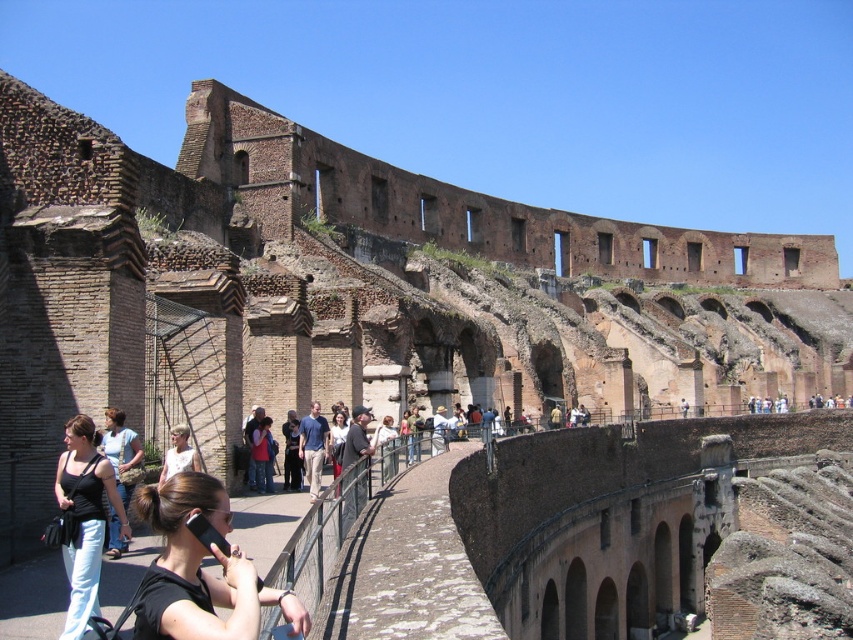
Question: Among these objects, which one is nearest to the camera?

Choices:
 (A) black matte phone at center
 (B) black denim jeans at lower left

Answer: (A)

Question: Is light brown leather jacket at lower left below white cotton shirt at center?

Choices:
 (A) no
 (B) yes

Answer: (B)

Question: Considering the relative positions of denim jacket at center and matte black shirt at center in the image provided, where is denim jacket at center located with respect to matte black shirt at center?

Choices:
 (A) below
 (B) above

Answer: (A)

Question: Estimate the real-world distances between objects in this image. Which object is closer to the white cotton shirt at center?

Choices:
 (A) matte black shirt at center
 (B) black matte phone at center

Answer: (A)

Question: Among these objects, which one is nearest to the camera?

Choices:
 (A) matte black shirt at center
 (B) light brown leather jacket at lower left
 (C) denim jacket at center
 (D) black matte phone at center

Answer: (D)

Question: Can you confirm if black matte phone at center is bigger than matte black shirt at center?

Choices:
 (A) yes
 (B) no

Answer: (A)